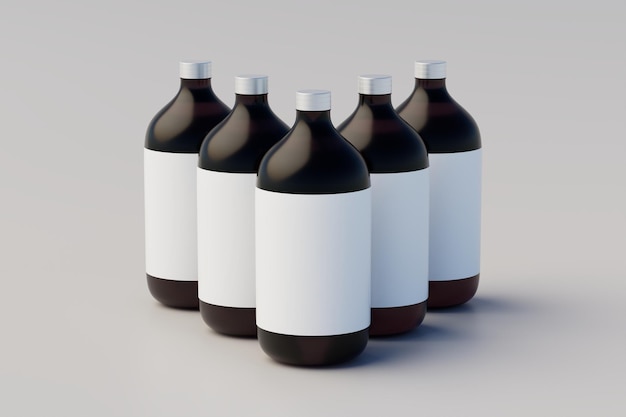
This screenshot has width=626, height=417. Identify the location of bottles with plain white labels. (158, 190), (228, 238), (312, 266), (399, 241), (456, 215).